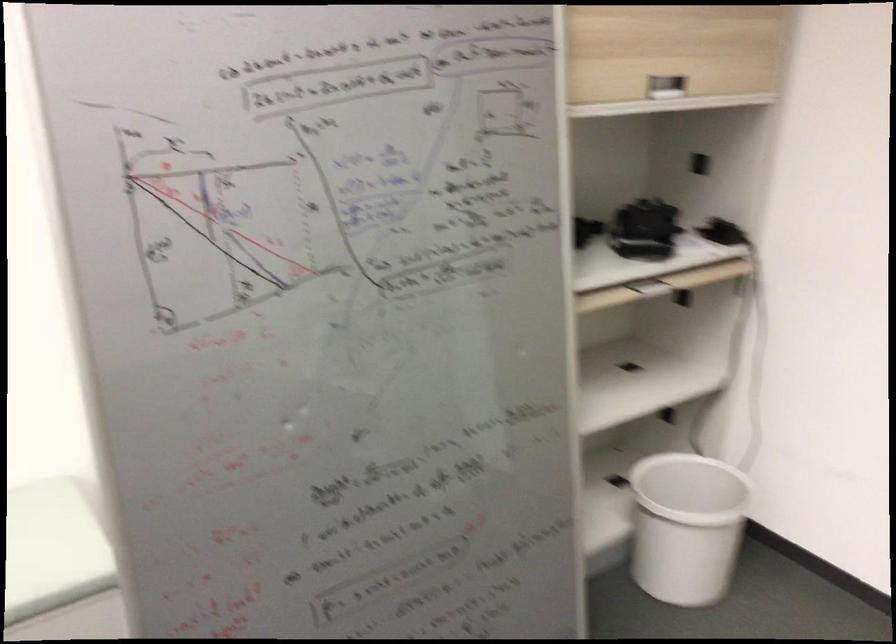
Where would you pull the recessed cabinet handle? Please return your answer as a coordinate pair (x, y).

(675, 303)